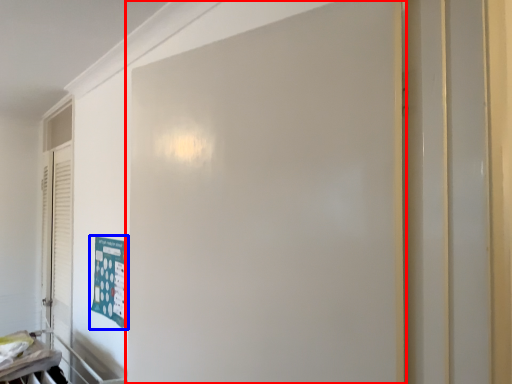
Question: Among these objects, which one is farthest to the camera, door (highlighted by a red box) or poster (highlighted by a blue box)?

Choices:
 (A) door
 (B) poster

Answer: (B)